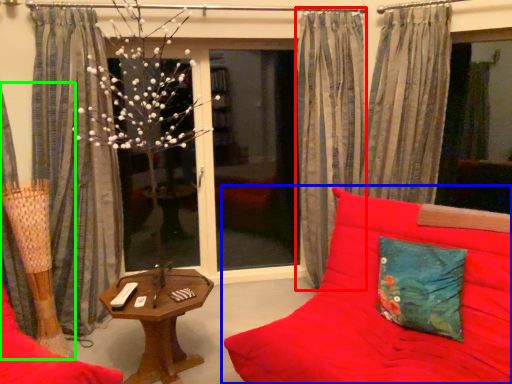
Question: Considering the real-world distances, which object is farthest from curtain (highlighted by a red box)? studio couch (highlighted by a blue box) or curtain (highlighted by a green box)?

Choices:
 (A) studio couch
 (B) curtain

Answer: (B)